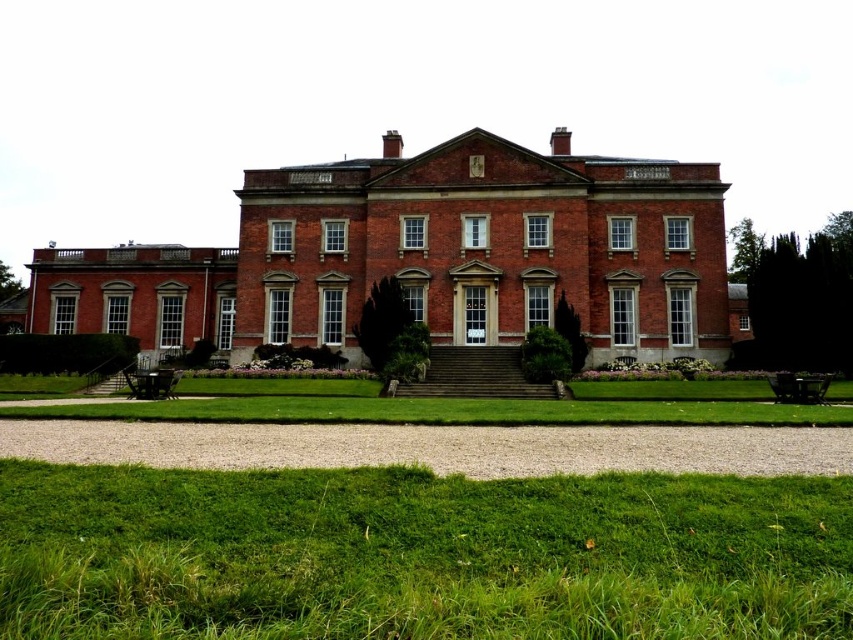
You are a visitor approaching the brick mansion at center and the dark brown wooden park bench at lower right. Which object would appear larger in your view as you walk towards them?

The brick mansion at center would appear larger in your view as you walk towards them because it is bigger than the dark brown wooden park bench at lower right.

You are standing on the green grass at lower center and want to enter the brick mansion at center. Which direction should you walk to approach the mansion?

Since the green grass at lower center is positioned under the brick mansion at center, you should walk upwards or towards the center to approach the mansion.

You are a landscape architect designing a new garden pathway. You need to place a statue that is 1.2 meters wide between the brick mansion at center and the dark brown wooden park bench at lower right. Based on their widths, will the statue fit between them without overlapping either structure?

The brick mansion at center might be wider than dark brown wooden park bench at lower right. Since the statue is 1.2 meters wide, it is impossible to determine if there is enough space between them without knowing the exact widths of both structures.